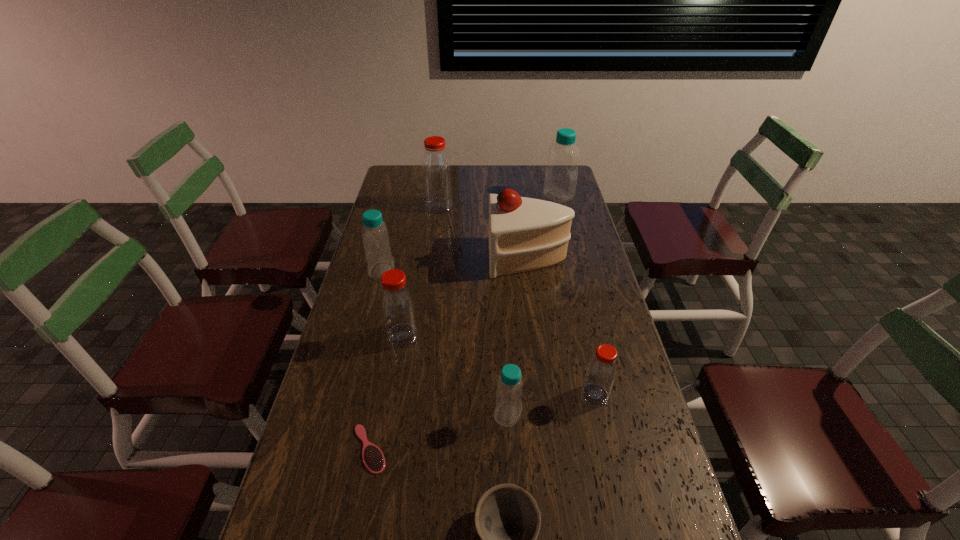
I want to click on vacant region located 0.310m on the right of the hairbrush, so click(516, 449).

Where is `object positioned at the far edge`? The width and height of the screenshot is (960, 540). object positioned at the far edge is located at coordinates (561, 174).

Locate an element on the screen. hairbrush present at the left edge is located at coordinates (373, 458).

You are a GUI agent. You are given a task and a screenshot of the screen. Output one action in this format:
    pyautogui.click(x=<x>, y=<y>)
    Task: Click on the cake located in the right edge section of the desktop
    
    Given the screenshot: What is the action you would take?
    pyautogui.click(x=525, y=234)

Identify the location of object present at the far right corner. The height and width of the screenshot is (540, 960). 561,174.

In the image, there is a desktop. Identify the location of vacant space at the far edge. (516, 176).

This screenshot has height=540, width=960. In order to click on free region at the left edge of the desktop in this screenshot , I will do pyautogui.click(x=321, y=535).

Image resolution: width=960 pixels, height=540 pixels. I want to click on vacant space at the right edge, so click(626, 387).

Image resolution: width=960 pixels, height=540 pixels. What are the coordinates of `free space between the nearest blue bottle and the shortest object` in the screenshot? It's located at (439, 431).

Identify the location of vacant area that lies between the second biggest red bottle and the shortest object. This screenshot has width=960, height=540. (386, 392).